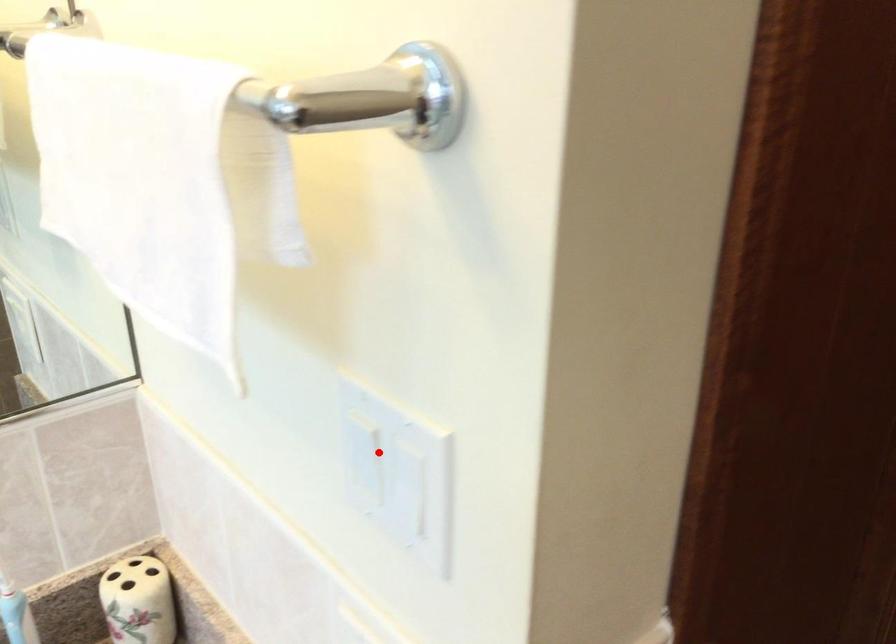
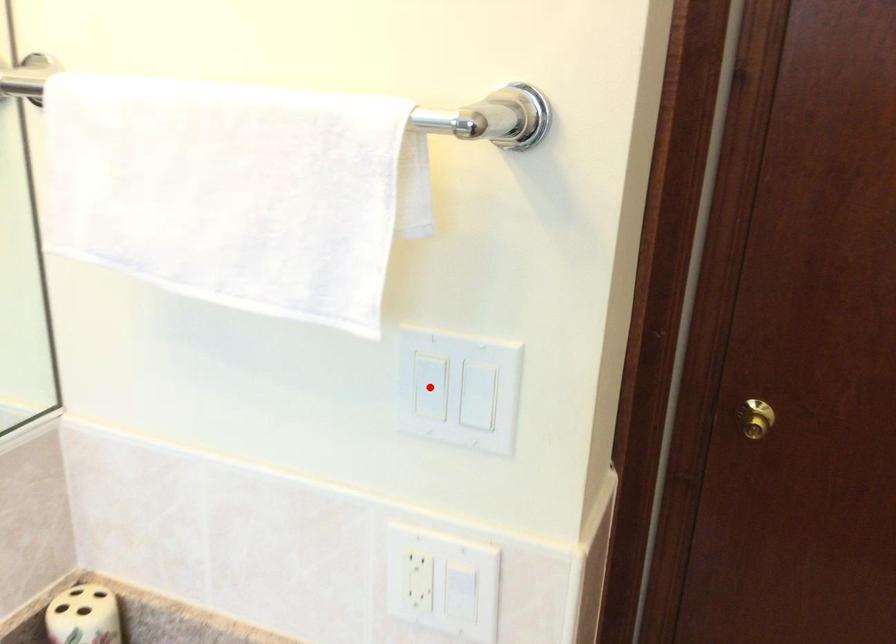
I am providing you with two images of the same scene from different viewpoints. A red point is marked on the first image and another point is marked on the second image. Are the points marked in image1 and image2 representing the same 3D position?

Yes